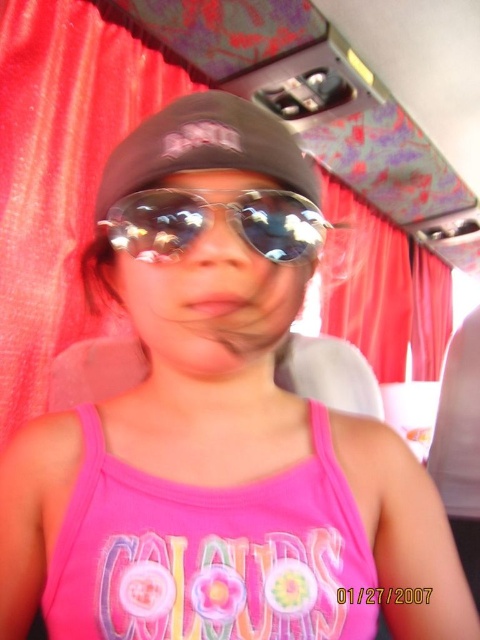
You are a photographer trying to capture the child in the image without any glare. The matte black baseball cap at center and shiny reflective sunglasses at center are both in your view. Which object should you avoid pointing the camera directly at to minimize glare?

You should avoid pointing the camera directly at the shiny reflective sunglasses at center because it reflects light, causing glare, while the matte black baseball cap at center does not reflect light as much.

You are a photographer trying to capture a clear shot of the child in the vehicle. The child is wearing a matte black baseball cap at center and shiny reflective sunglasses at center. Since the sunlight is causing glare, which object might be more problematic due to its reflective surface? Explain your reasoning.

The shiny reflective sunglasses at center are more problematic due to their reflective surface, which causes glare from the sunlight, making it harder to capture a clear shot of the child.

You are a photographer trying to capture a closeup shot of the matte black baseball cap at center. The camera you are using has a minimum focusing distance of 12 inches. Can you take the photo without moving the camera or the cap?

The matte black baseball cap at center and viewer are 13.00 inches apart from each other. Since the minimum focusing distance is 12 inches, the camera can focus on the matte black baseball cap at center as it is beyond the minimum distance required.